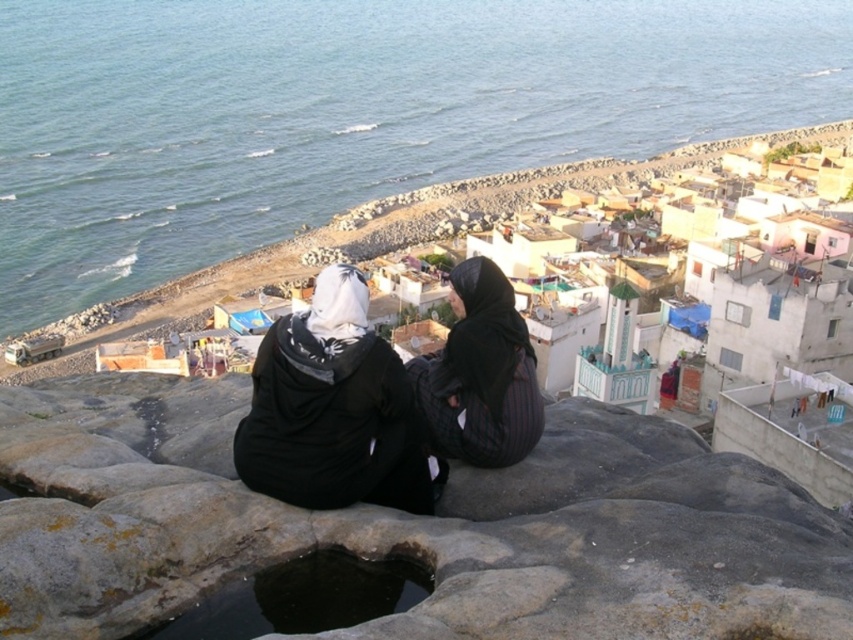
You are a geologist examining the coastal scene. You need to locate the gray rough stone at center for a study. Based on the coordinates provided, can you determine its position relative to the edge of the image?

The gray rough stone at center is located at coordinates point (409, 525), which places it closer to the right edge and slightly above the bottom edge of the image.

You are a photographer trying to capture the two people in the scene. You want to ensure that both the gray rough stone at center and the black matte hijab at center are clearly visible in your shot. Based on their positions, which object should you focus on first to ensure both are in focus?

The gray rough stone at center is positioned on the right side of black matte hijab at center. To ensure both are in focus, you should focus on the black matte hijab at center first since it is closer to the camera, and the gray rough stone at center will also be within the depth of field if focused properly.

You are a hiker who wants to place a 10 meter long rope between the black textured fabric at center and the dark stone hole at center. Can you safely secure the rope between them?

The distance between the black textured fabric at center and the dark stone hole at center is 10.66 meters. Since the rope is 10 meters long, it will be 0.66 meters shorter than needed. Therefore, the rope cannot be safely secured between them.